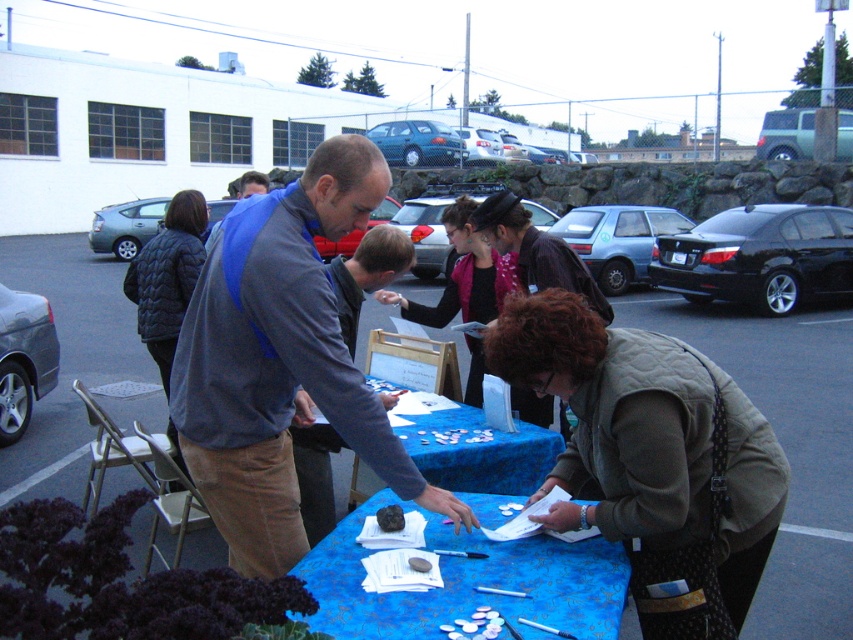
From the picture: Is the position of matte black vest at center less distant than that of matte gray jacket at center?

That is False.

Which is more to the left, matte black vest at center or matte gray jacket at center?

From the viewer's perspective, matte gray jacket at center appears more on the left side.

Is point (508, 262) more distant than point (395, 234)?

Yes.

I want to click on matte black vest at center, so click(463, 275).

Does green quilted vest at lower right have a greater height compared to blue fabric table at center?

Correct, green quilted vest at lower right is much taller as blue fabric table at center.

In the scene shown: Is green quilted vest at lower right further to the viewer compared to blue fabric table at center?

Yes.

Who is more distant from viewer, [741,552] or [595,602]?

The point [741,552] is behind.

At what (x,y) coordinates should I click in order to perform the action: click on green quilted vest at lower right. Please return your answer as a coordinate pair (x, y). This screenshot has width=853, height=640. Looking at the image, I should click on (646, 440).

Does point (497, 332) come closer to viewer compared to point (570, 250)?

Yes, it is.

In order to click on green quilted vest at lower right in this screenshot , I will do click(x=646, y=440).

What do you see at coordinates (646, 440) in the screenshot?
I see `green quilted vest at lower right` at bounding box center [646, 440].

At what (x,y) coordinates should I click in order to perform the action: click on green quilted vest at lower right. Please return your answer as a coordinate pair (x, y). The height and width of the screenshot is (640, 853). Looking at the image, I should click on (646, 440).